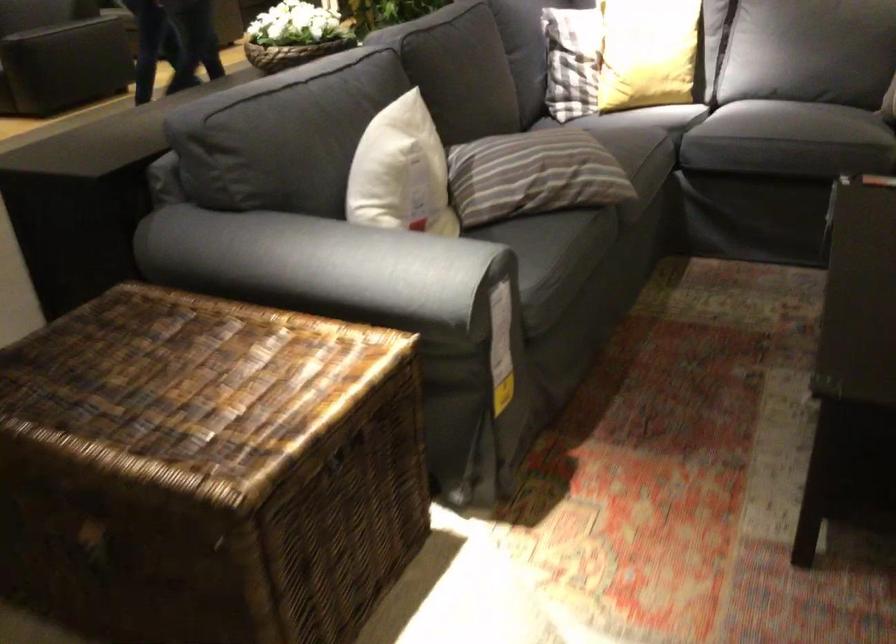
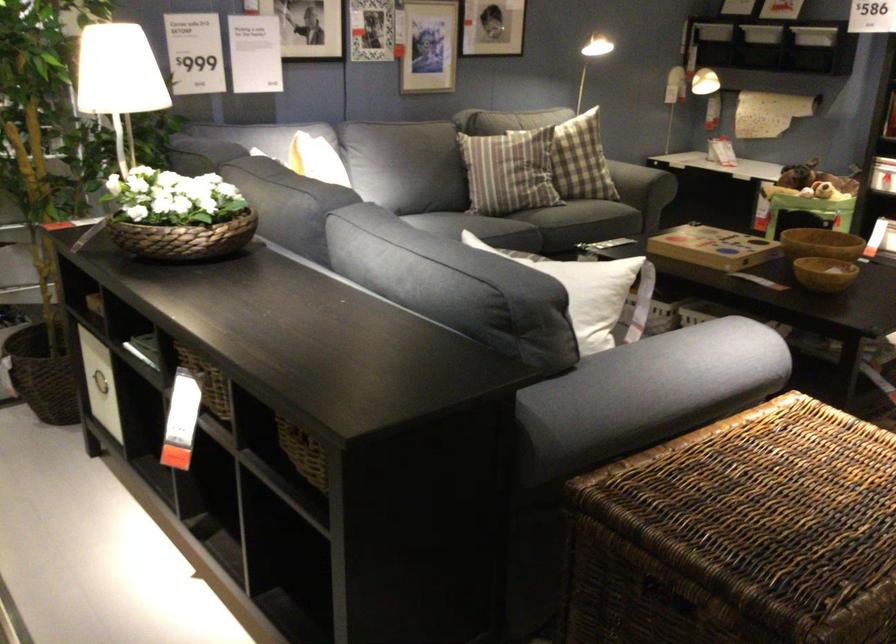
In the second image, find the point that corresponds to (173,426) in the first image.

(776, 509)